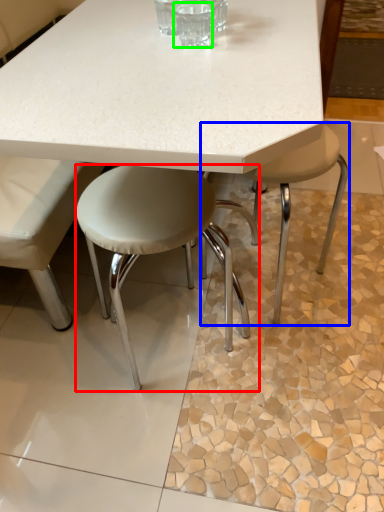
Question: Which object is positioned farthest from stool (highlighted by a red box)? Select from stool (highlighted by a blue box) and clear (highlighted by a green box).

Choices:
 (A) stool
 (B) clear

Answer: (A)